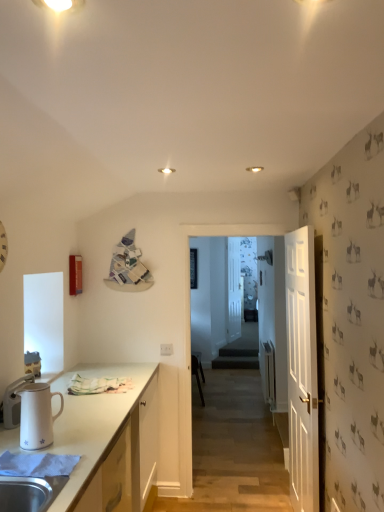
Question: From the image's perspective, is white matte clock at left on black plastic chair at center?

Choices:
 (A) no
 (B) yes

Answer: (B)

Question: Is black plastic chair at center at the back of white matte clock at left?

Choices:
 (A) yes
 (B) no

Answer: (B)

Question: Is black plastic chair at center completely or partially inside white matte clock at left?

Choices:
 (A) no
 (B) yes

Answer: (A)

Question: Can you confirm if white matte clock at left is thinner than black plastic chair at center?

Choices:
 (A) yes
 (B) no

Answer: (A)

Question: Can you confirm if white matte clock at left is positioned to the left of black plastic chair at center?

Choices:
 (A) no
 (B) yes

Answer: (B)

Question: Could you tell me if white matte clock at left is turned towards black plastic chair at center?

Choices:
 (A) no
 (B) yes

Answer: (A)

Question: Is the depth of white glossy pitcher at left greater than that of white plastic electric outlet at center?

Choices:
 (A) yes
 (B) no

Answer: (B)

Question: Can you confirm if white glossy pitcher at left is bigger than white plastic electric outlet at center?

Choices:
 (A) yes
 (B) no

Answer: (A)

Question: Is white glossy pitcher at left positioned with its back to white plastic electric outlet at center?

Choices:
 (A) yes
 (B) no

Answer: (B)

Question: Does white glossy pitcher at left have a smaller size compared to white plastic electric outlet at center?

Choices:
 (A) no
 (B) yes

Answer: (A)

Question: From a real-world perspective, is white glossy pitcher at left physically below white plastic electric outlet at center?

Choices:
 (A) yes
 (B) no

Answer: (B)

Question: From the image's perspective, does white glossy pitcher at left appear higher than white plastic electric outlet at center?

Choices:
 (A) no
 (B) yes

Answer: (B)

Question: From the image's perspective, is white matte clock at left below white glossy pitcher at left?

Choices:
 (A) no
 (B) yes

Answer: (A)